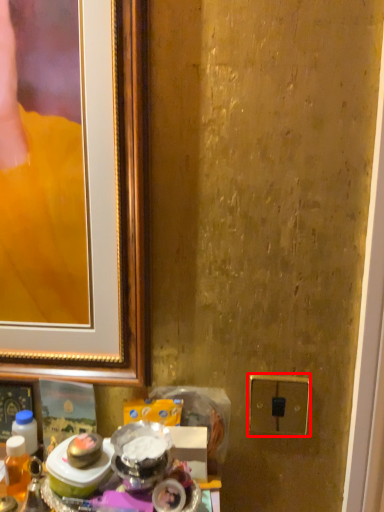
Question: From the image's perspective, what is the correct spatial positioning of electric outlet (annotated by the red box) in reference to beverage?

Choices:
 (A) above
 (B) below

Answer: (A)